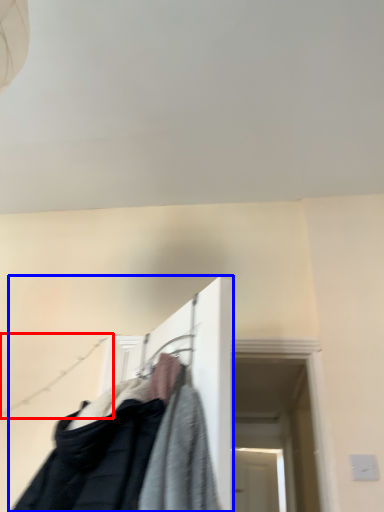
Question: Which point is closer to the camera, clothesline (highlighted by a red box) or closet (highlighted by a blue box)?

Choices:
 (A) clothesline
 (B) closet

Answer: (B)